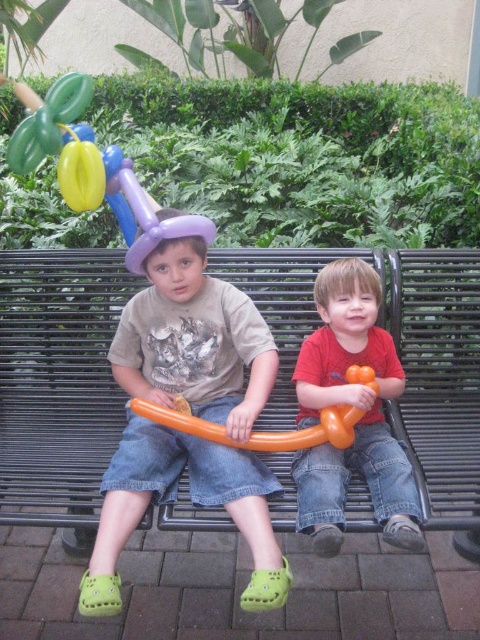
Question: Which point is farther to the camera?

Choices:
 (A) yellow rubber balloon at upper left
 (B) black metal bench at center
 (C) matte purple balloon hat at center

Answer: (A)

Question: Is black metal bench at center to the left of matte orange balloon animal at center from the viewer's perspective?

Choices:
 (A) no
 (B) yes

Answer: (B)

Question: Is orange rubber balloon at center bigger than yellow rubber balloon at upper left?

Choices:
 (A) yes
 (B) no

Answer: (A)

Question: Which point is farther from the camera taking this photo?

Choices:
 (A) [148, 387]
 (B) [78, 152]

Answer: (A)

Question: Can you confirm if orange rubber balloon at center is positioned to the right of yellow rubber balloon at upper left?

Choices:
 (A) yes
 (B) no

Answer: (A)

Question: Considering the real-world distances, which object is farthest from the yellow rubber balloon at upper left?

Choices:
 (A) orange rubber balloon at center
 (B) black metal bench at center
 (C) matte purple balloon hat at center
 (D) matte orange balloon animal at center

Answer: (D)